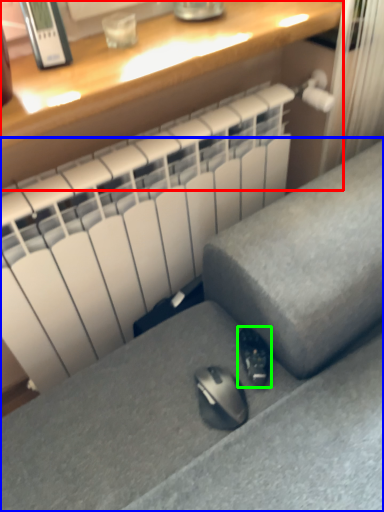
Question: Estimate the real-world distances between objects in this image. Which object is farther from desk (highlighted by a red box), furniture (highlighted by a blue box) or shoe (highlighted by a green box)?

Choices:
 (A) furniture
 (B) shoe

Answer: (B)